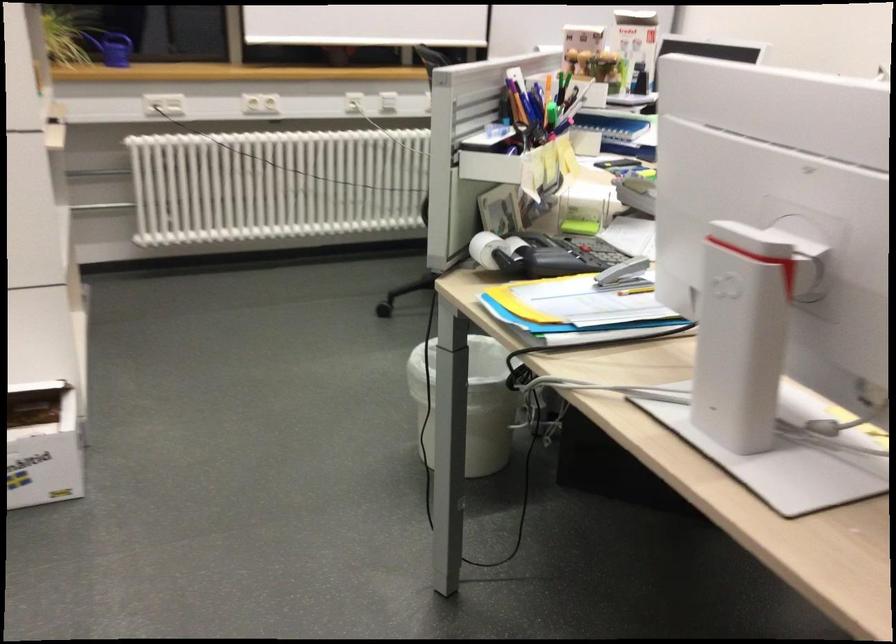
Identify the location of yellow paper folder. 562,299.